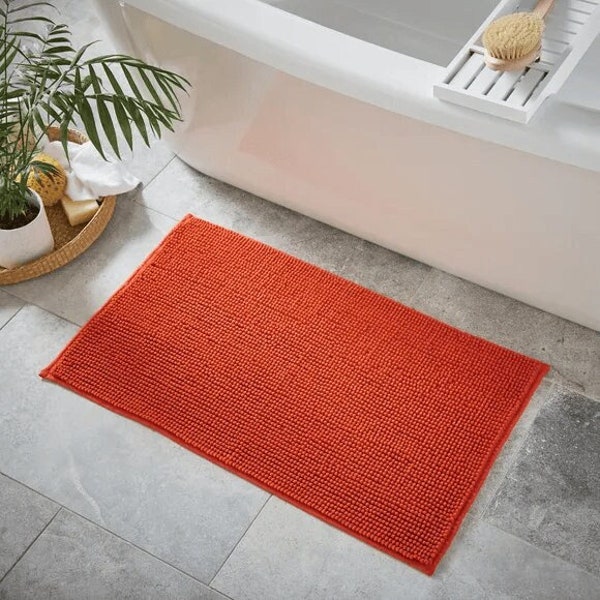
The image size is (600, 600). Find the location of `palm plant`. palm plant is located at coordinates (112, 100), (37, 77), (7, 51).